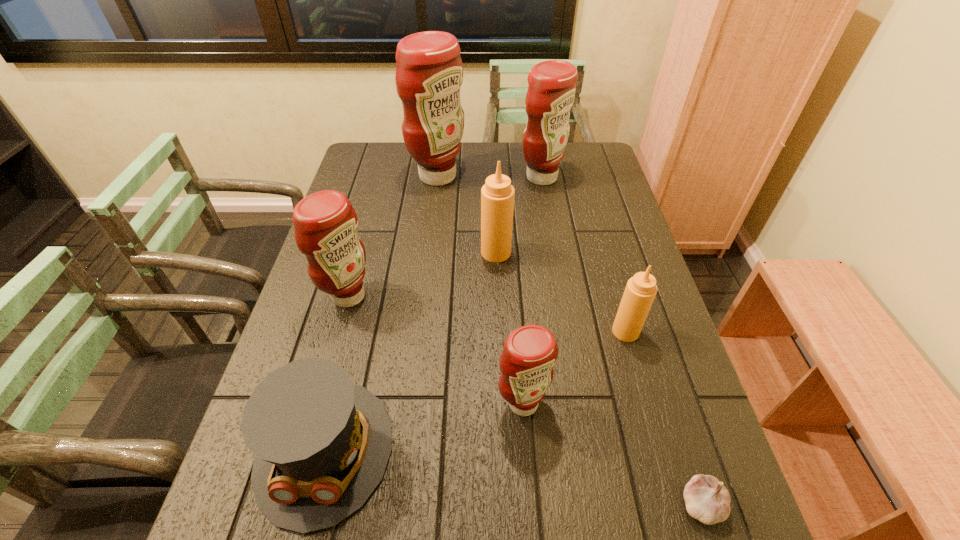
Where is `free space at the far right corner of the desktop`? This screenshot has height=540, width=960. free space at the far right corner of the desktop is located at coordinates (593, 151).

Identify the location of vacant area that lies between the white garlic and the bigger tan condiment. The width and height of the screenshot is (960, 540). (599, 378).

The image size is (960, 540). What are the coordinates of `free space between the second shortest object and the tallest condiment` in the screenshot? It's located at (381, 313).

Locate an element on the screen. This screenshot has height=540, width=960. empty space between the nearest condiment and the rightmost condiment is located at coordinates pyautogui.click(x=574, y=367).

The height and width of the screenshot is (540, 960). Identify the location of blank region between the nearest red condiment and the tallest object. (480, 289).

Locate an element on the screen. This screenshot has width=960, height=540. vacant space that's between the fourth nearest condiment and the nearest red condiment is located at coordinates (510, 328).

Identify the location of blank region between the second red condiment from left to right and the right tan condiment. (532, 254).

Where is `free point between the garlic and the tallest condiment`? free point between the garlic and the tallest condiment is located at coordinates (570, 340).

The image size is (960, 540). Identify the location of free spot between the third nearest condiment and the third red condiment from right to left. (394, 236).

Identify which object is the second nearest to the nearest red condiment. Please provide its 2D coordinates. Your answer should be formatted as a tuple, i.e. [(x, y)], where the tuple contains the x and y coordinates of a point satisfying the conditions above.

[(641, 289)]